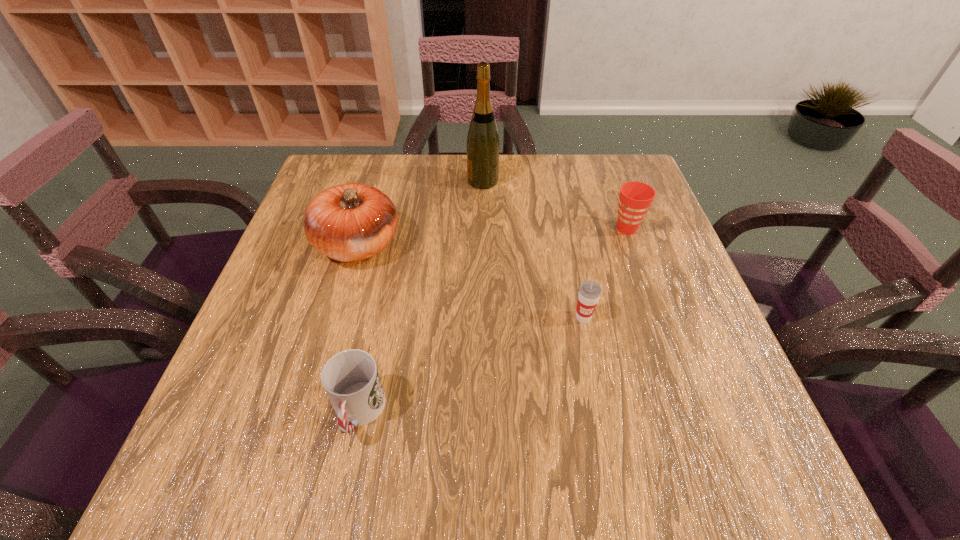
Where is `free space between the second nearest object and the leftmost cup`? free space between the second nearest object and the leftmost cup is located at coordinates (471, 365).

What are the coordinates of `empty space that is in between the second nearest object and the rightmost object` in the screenshot? It's located at (605, 273).

This screenshot has height=540, width=960. In order to click on free space that is in between the second tallest object and the wine bottle in this screenshot , I will do `click(420, 213)`.

Where is `unoccupied area between the leftmost cup and the farthest cup`? unoccupied area between the leftmost cup and the farthest cup is located at coordinates (492, 321).

In order to click on vacant point located between the second cup from left to right and the fourth shortest object in this screenshot , I will do `click(470, 281)`.

Locate an element on the screen. The height and width of the screenshot is (540, 960). free space between the second tallest object and the second nearest object is located at coordinates (470, 281).

Locate an element on the screen. The height and width of the screenshot is (540, 960). object that is the second closest to the third object from right to left is located at coordinates pos(635,198).

Locate which object is the second closest to the farthest cup. Please provide its 2D coordinates. Your answer should be formatted as a tuple, i.e. [(x, y)], where the tuple contains the x and y coordinates of a point satisfying the conditions above.

[(483, 144)]

Identify the location of cup that stands as the second closest to the rightmost cup. (351, 380).

Where is `cup that is the nearest to the third object from left to right`? cup that is the nearest to the third object from left to right is located at coordinates (635, 198).